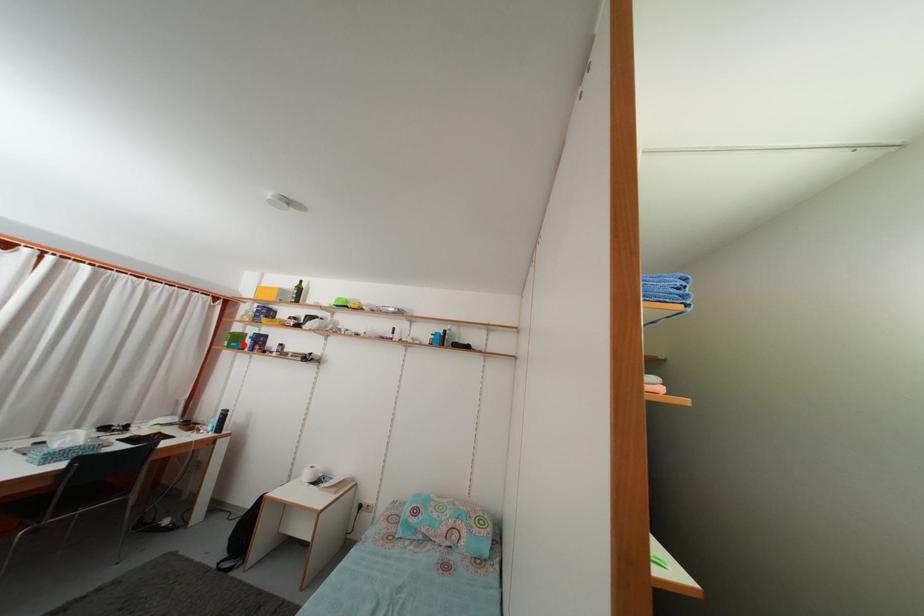
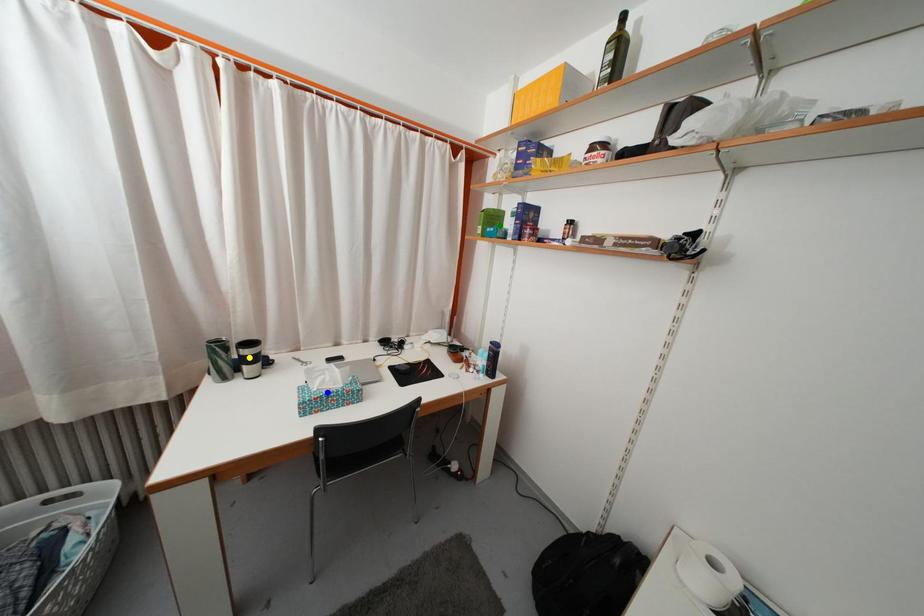
Question: I am providing you with two images of the same scene from different viewpoints. A red point is marked on the first image. You are given multiple points on the second image. In image 2, which mark is for the same physical point as the one in image 1?

Choices:
 (A) green point
 (B) blue point
 (C) yellow point

Answer: (A)